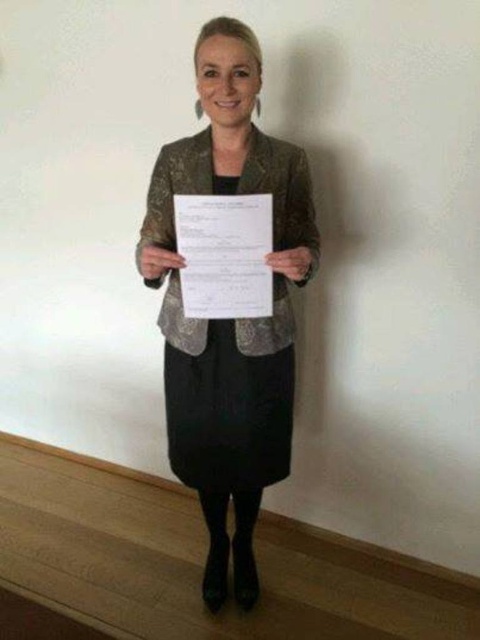
Does point (156, 282) come behind point (183, 266)?

Yes.

Which is above, metallic gold blazer at center or white paper at center?

white paper at center is higher up.

Is point (240, 134) closer to camera compared to point (203, 230)?

No, it is behind (203, 230).

This screenshot has height=640, width=480. I want to click on metallic gold blazer at center, so click(228, 317).